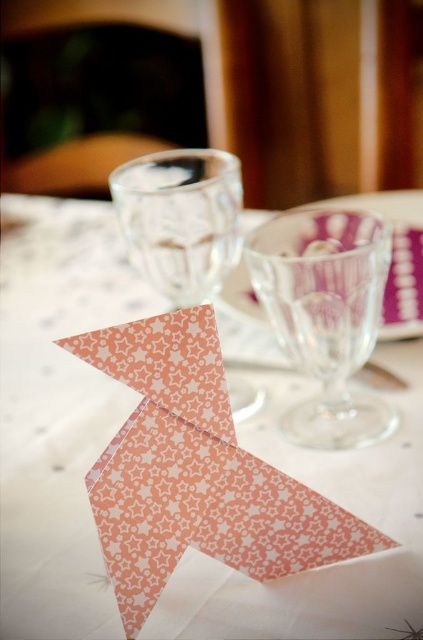
You are at a formal event and notice two points on the table. The first point is at coordinates point (263,292) and the second is at point (153,224). From your perspective, which point is closer to you?

Point (263,292) is in front of point (153,224), so it is closer to you.

You are arranging a table for a formal dinner and need to place the pink paper origami at center and the transparent glass wine glass at center. Based on their sizes, which object should you place first to ensure proper positioning?

The pink paper origami at center might be wider than transparent glass wine glass at center, so you should place the pink paper origami at center first to ensure there is enough space for the wine glass.

You are setting up a table for a formal dinner and have two wine glasses in front of you. One is labeled as the clear glass wine glass at center and the other as the transparent glass wine glass at center. Which of these two glasses is shorter in height?

The clear glass wine glass at center is shorter in height compared to the transparent glass wine glass at center.